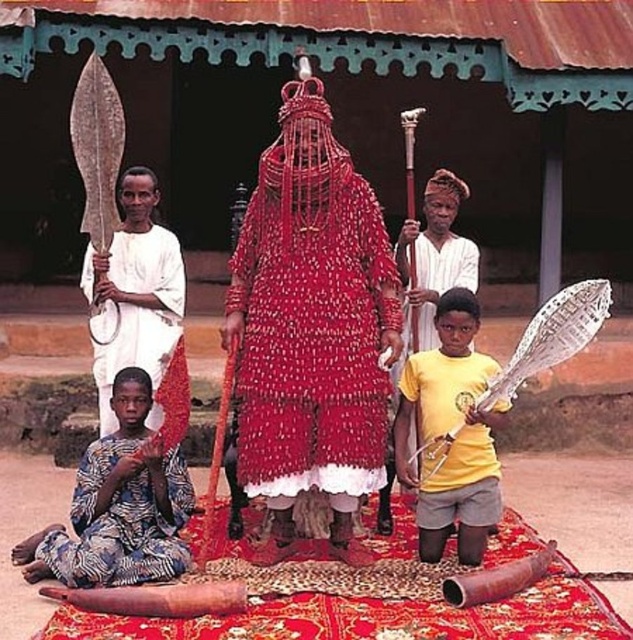
You are a photographer standing at the edge of the scene. You want to capture a photo where both the printed fabric child at lower left and the yellow matte shirt at center are in focus. Given that your camera can only focus on objects within a 10 feet range, will you be able to achieve this?

The printed fabric child at lower left is 9.27 feet away from the yellow matte shirt at center. Since the distance between them is within the 10 feet range, you can capture both in focus.

Consider the image. You are a photographer trying to capture the central figure in the image. You notice two points marked at coordinates point (461,458) and point (396,252). Which of these points is closer to the camera and thus more likely to be in focus if you focus on the central figure?

Point (461,458) is closer to the camera than point (396,252), so focusing on it would likely keep the central figure in focus.